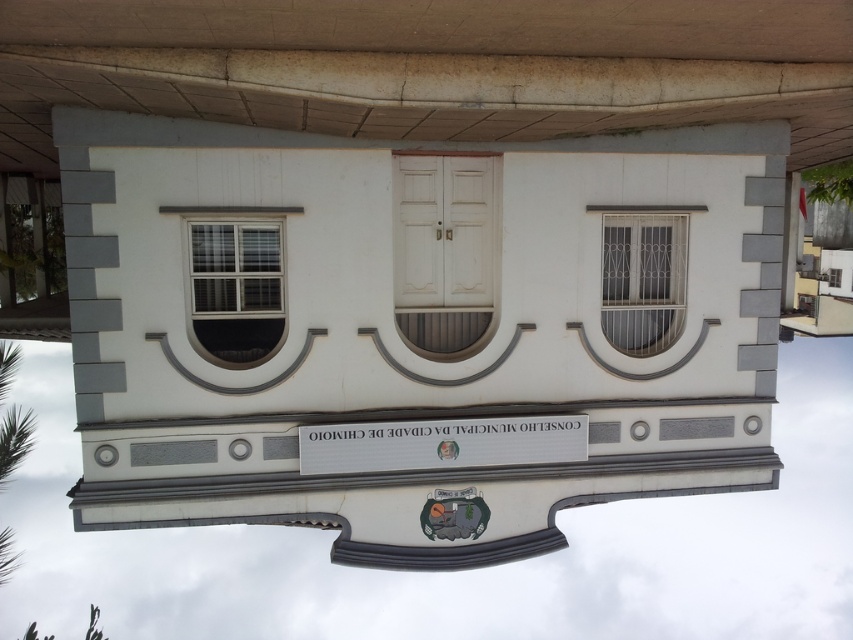
You are a visitor to the building and want to locate the entrance. You see the white plastic sign at center and the white metal window at center. Which object is positioned to the left of the other?

The white plastic sign at center is to the left of the white metal window at center.

You are standing in front of the building and want to move from the point at coordinates point (276, 289) to the point at coordinates point (625, 324). Which direction should you move to get closer to your destination?

To move from point (276, 289) to point (625, 324), you should move downward and to the right because point (276, 289) is in front of point (625, 324), indicating it is closer to the viewer. Moving towards the lower right will bring you closer to the destination.